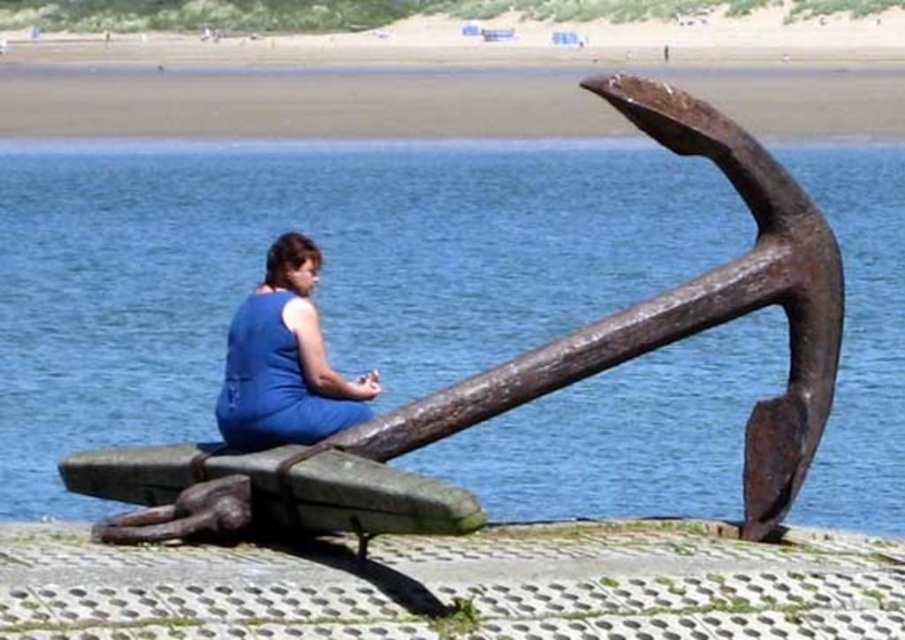
You are standing at the edge of the water and want to place a small bucket on the smooth sand at upper center without it going near the blue fabric dress at center. Is there enough space between them?

The smooth sand at upper center is wider than the blue fabric dress at center, so there is sufficient space to place the bucket away from the dress.

You are standing at the edge of the water and want to place a small seashell on the smooth sand at upper center without stepping on the blue fabric dress at center. Is this possible?

The blue fabric dress at center is behind the smooth sand at upper center, so you can place the seashell on the smooth sand at upper center without stepping on the dress as the dress is not in front of the sand.

You are a photographer planning to take a photo of the smooth sand at upper center and the blue fabric dress at center. Given that your camera has a maximum focus range of 80 meters, will both objects be in focus at the same time?

The smooth sand at upper center and blue fabric dress at center are 85.15 meters apart from each other, which exceeds the camera maximum focus range of 80 meters. Therefore, both objects cannot be in focus simultaneously.